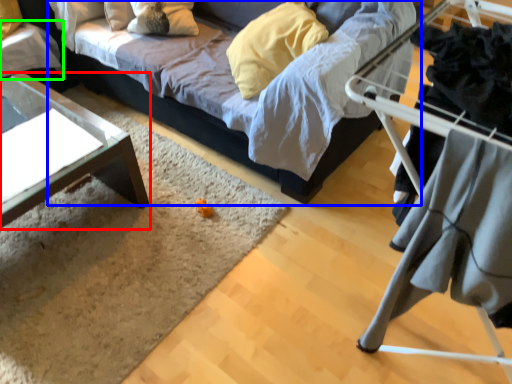
Question: Estimate the real-world distances between objects in this image. Which object is closer to table (highlighted by a red box), studio couch (highlighted by a blue box) or table (highlighted by a green box)?

Choices:
 (A) studio couch
 (B) table

Answer: (B)